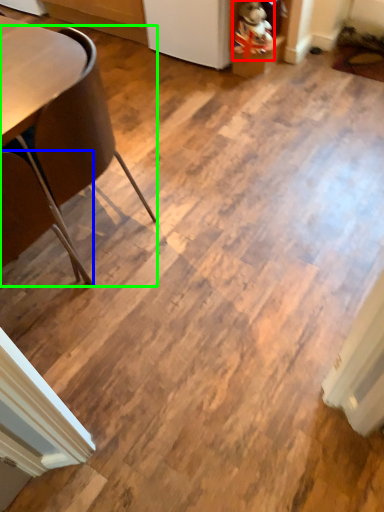
Question: Considering the real-world distances, which object is farthest from toy (highlighted by a red box)? chair (highlighted by a blue box) or chair (highlighted by a green box)?

Choices:
 (A) chair
 (B) chair

Answer: (A)